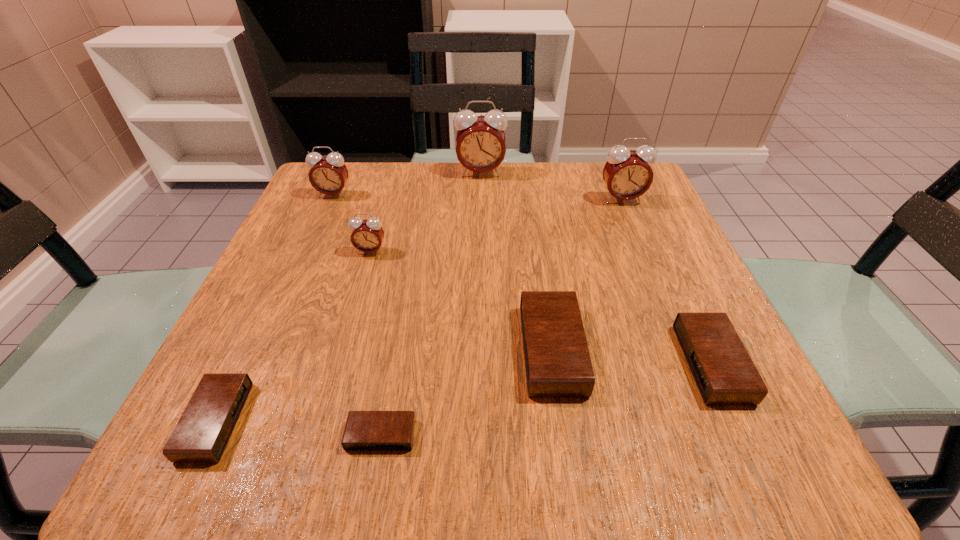
Where is `empty space that is in between the leftmost pink alarm clock and the second shortest object`? empty space that is in between the leftmost pink alarm clock and the second shortest object is located at coordinates (275, 308).

Identify the location of free space that is in between the fifth alarm clock from right to left and the second tallest object. click(501, 317).

Locate an element on the screen. blank region between the sixth shortest alarm clock and the shortest object is located at coordinates (357, 315).

Identify the location of empty space that is in between the second tallest object and the sixth shortest alarm clock. (477, 197).

Find the location of a particular element. The image size is (960, 540). vacant point located between the rightmost pink alarm clock and the seventh tallest alarm clock is located at coordinates (419, 310).

Where is `empty location between the rightmost black alarm clock and the farthest pink alarm clock`? empty location between the rightmost black alarm clock and the farthest pink alarm clock is located at coordinates (596, 268).

In order to click on blank region between the seventh tallest object and the sixth tallest object in this screenshot , I will do `click(464, 392)`.

At what (x,y) coordinates should I click in order to perform the action: click on vacant area that lies between the smallest pink alarm clock and the second tallest object. Please return your answer as a coordinate pair (x, y). The width and height of the screenshot is (960, 540). Looking at the image, I should click on (496, 225).

Locate which object ranks third in proximity to the fourth shortest object. Please provide its 2D coordinates. Your answer should be formatted as a tuple, i.e. [(x, y)], where the tuple contains the x and y coordinates of a point satisfying the conditions above.

[(367, 235)]

This screenshot has height=540, width=960. Identify the location of object identified as the seventh closest to the sixth shortest alarm clock. 725,374.